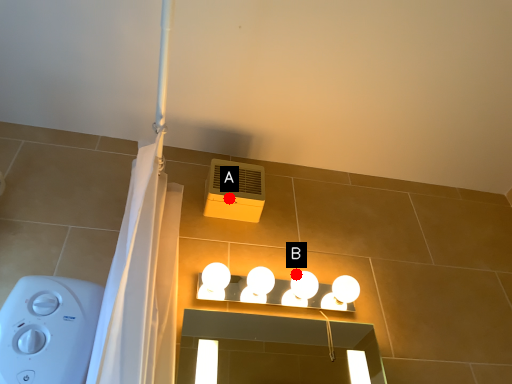
Question: Two points are circled on the image, labeled by A and B beside each circle. Which point is farther from the camera taking this photo?

Choices:
 (A) A is further
 (B) B is further

Answer: (A)